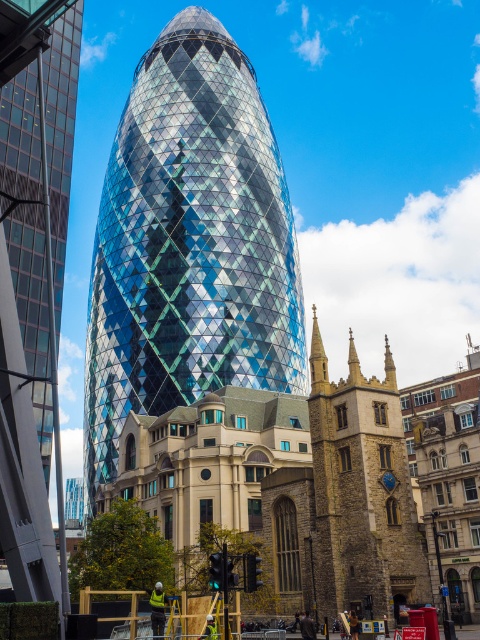
Is shiny glass tower at center smaller than shiny glass skyscraper at center?

Yes, shiny glass tower at center is smaller than shiny glass skyscraper at center.

Does shiny glass tower at center have a greater height compared to shiny glass skyscraper at center?

Yes.

Between point (204, 224) and point (2, 3), which one is positioned in front?

Point (2, 3) is more forward.

The height and width of the screenshot is (640, 480). I want to click on shiny glass tower at center, so click(x=189, y=244).